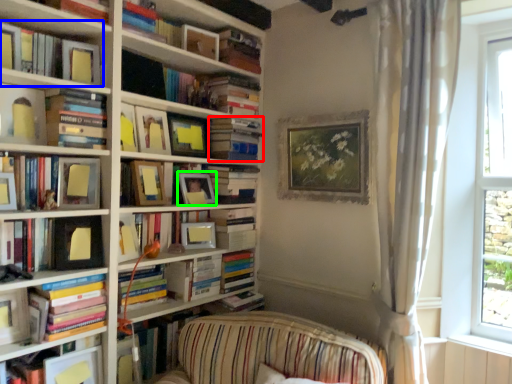
Question: Considering the real-world distances, which object is farthest from book (highlighted by a red box)? book (highlighted by a blue box) or picture frame (highlighted by a green box)?

Choices:
 (A) book
 (B) picture frame

Answer: (A)